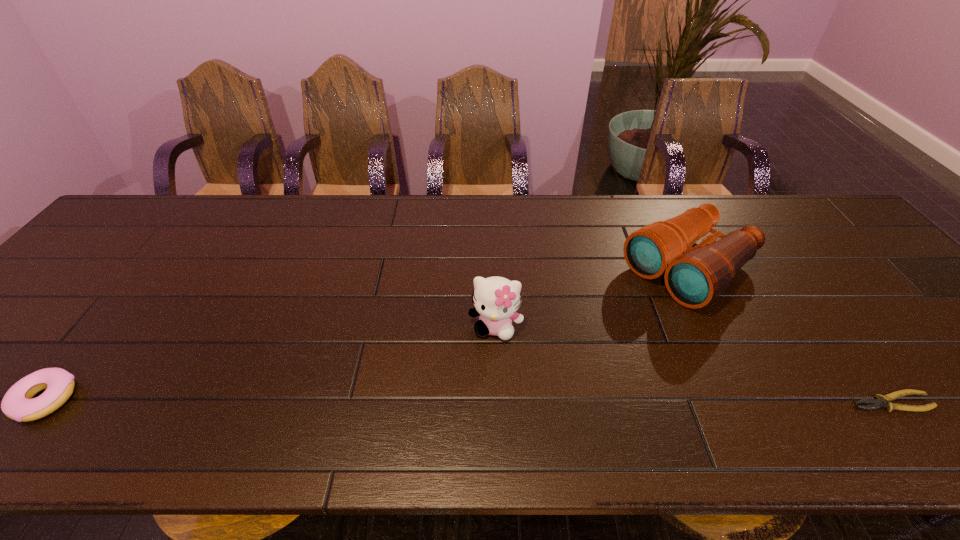
Locate an element on the screen. free space between the binoculars and the kitten is located at coordinates (592, 298).

Identify which object is located as the second nearest to the rightmost object. Please provide its 2D coordinates. Your answer should be formatted as a tuple, i.e. [(x, y)], where the tuple contains the x and y coordinates of a point satisfying the conditions above.

[(496, 300)]

Identify which object is the third closest to the kitten. Please provide its 2D coordinates. Your answer should be formatted as a tuple, i.e. [(x, y)], where the tuple contains the x and y coordinates of a point satisfying the conditions above.

[(17, 404)]